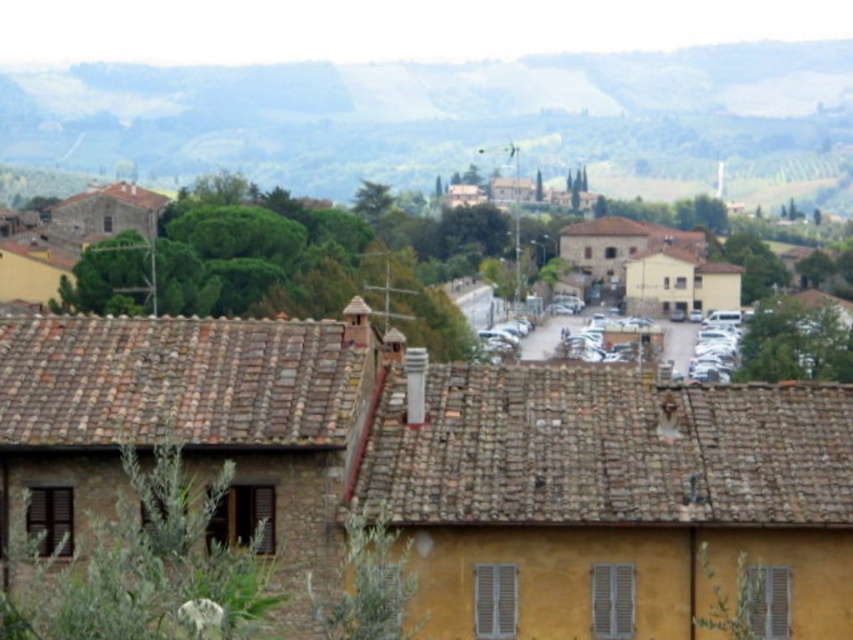
Question: Considering the relative positions of brown stone building at center and green grassy hillside at upper center in the image provided, where is brown stone building at center located with respect to green grassy hillside at upper center?

Choices:
 (A) left
 (B) right

Answer: (A)

Question: Which point is farther to the camera?

Choices:
 (A) green grassy hillside at upper center
 (B) brown stone building at center

Answer: (A)

Question: Which point is closer to the camera?

Choices:
 (A) brown stone building at center
 (B) green grassy hillside at upper center

Answer: (A)

Question: Does brown stone building at center appear on the left side of green grassy hillside at upper center?

Choices:
 (A) no
 (B) yes

Answer: (B)

Question: Which of the following is the closest to the observer?

Choices:
 (A) brown stone building at center
 (B) green grassy hillside at upper center

Answer: (A)

Question: Can you confirm if brown stone building at center is smaller than green grassy hillside at upper center?

Choices:
 (A) yes
 (B) no

Answer: (A)